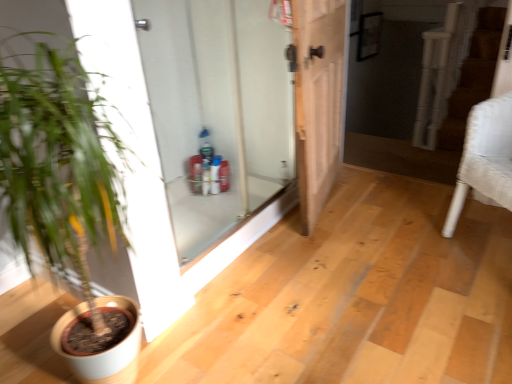
The image size is (512, 384). Identify the location of vacant space in front of light brown wooden door at center, which appears as the 1th door when viewed from the right. (342, 253).